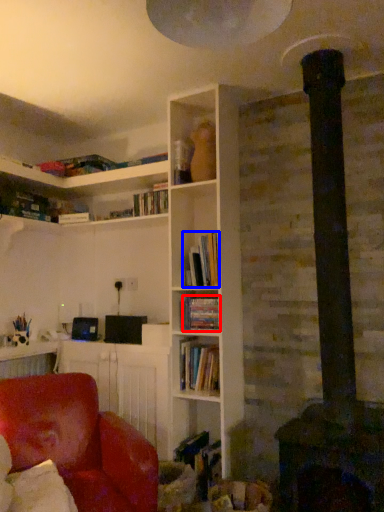
Question: Which of the following is the closest to the observer, book (highlighted by a red box) or book (highlighted by a blue box)?

Choices:
 (A) book
 (B) book

Answer: (B)